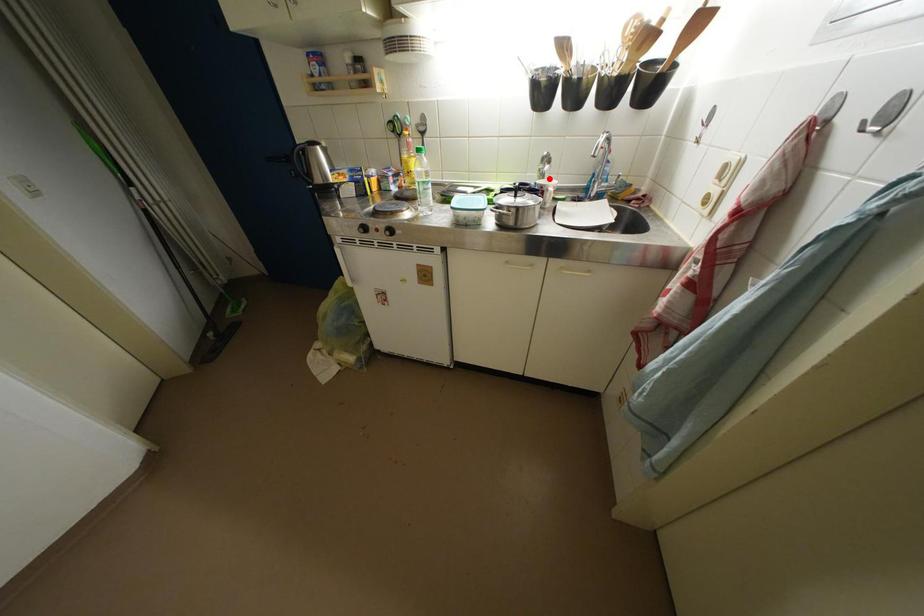
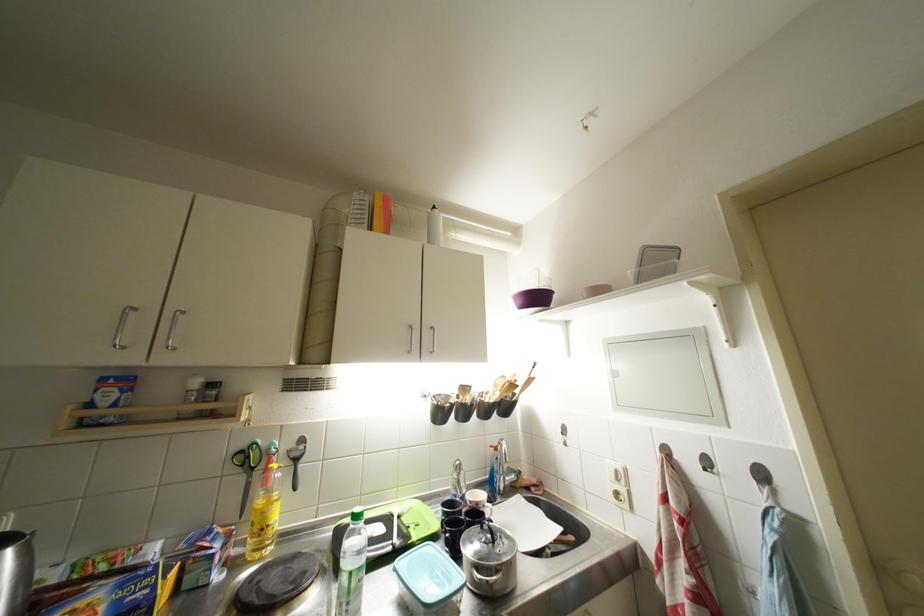
The point at the highlighted location is marked in the first image. Where is the corresponding point in the second image?

(466, 487)